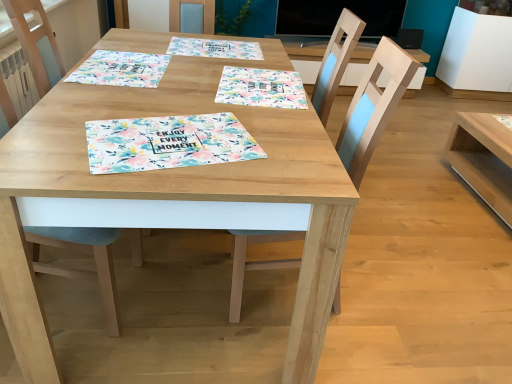
Identify the location of free spot below floral paper placemat at center (from a real-world perspective). Image resolution: width=512 pixels, height=384 pixels. (174, 140).